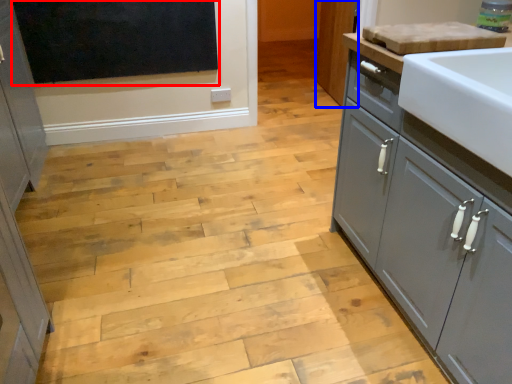
Question: Which object appears farthest to the camera in this image, window screen (highlighted by a red box) or cabinetry (highlighted by a blue box)?

Choices:
 (A) window screen
 (B) cabinetry

Answer: (B)